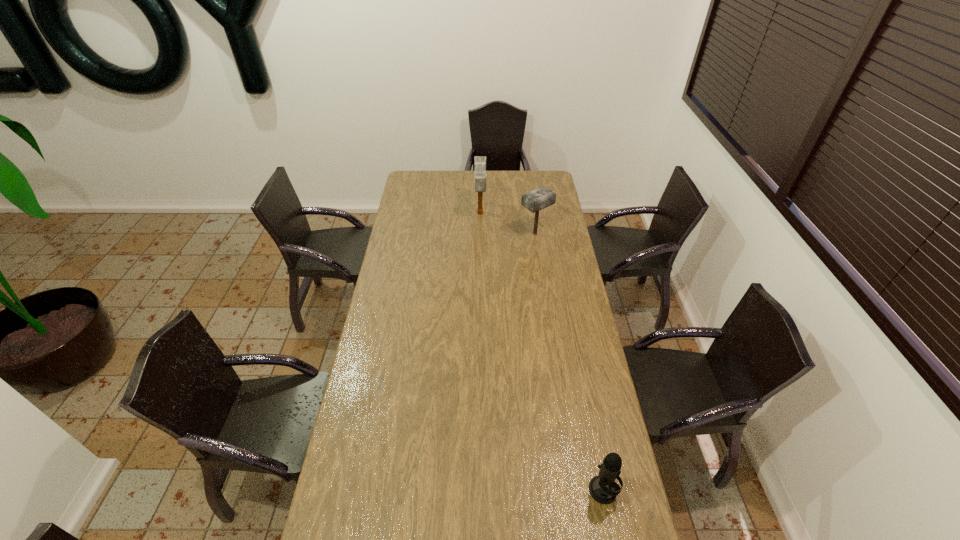
Find the location of `the leftmost object`. the leftmost object is located at coordinates (479, 161).

Image resolution: width=960 pixels, height=540 pixels. I want to click on the right mallet, so click(x=538, y=199).

At what (x,y) coordinates should I click in order to perform the action: click on the nearest object. Please return your answer as a coordinate pair (x, y). Looking at the image, I should click on (603, 488).

The height and width of the screenshot is (540, 960). I want to click on the shortest object, so click(603, 488).

I want to click on vacant area situated 0.050m on the front of the leftmost object, so click(480, 231).

The image size is (960, 540). Identify the location of free spot located 0.270m on the left of the right mallet. (468, 234).

Where is `vacant area situated on the left of the shortest object`? The image size is (960, 540). vacant area situated on the left of the shortest object is located at coordinates (516, 490).

You are a GUI agent. You are given a task and a screenshot of the screen. Output one action in this format:
    pyautogui.click(x=<x>, y=<y>)
    Task: Click on the mallet that is at the right edge
    This screenshot has width=960, height=540.
    Given the screenshot: What is the action you would take?
    pyautogui.click(x=538, y=199)

Find the location of a particular element. The image size is (960, 540). microphone situated at the right edge is located at coordinates (603, 488).

Image resolution: width=960 pixels, height=540 pixels. Identify the location of vacant position at the left edge of the desktop. coord(365,418).